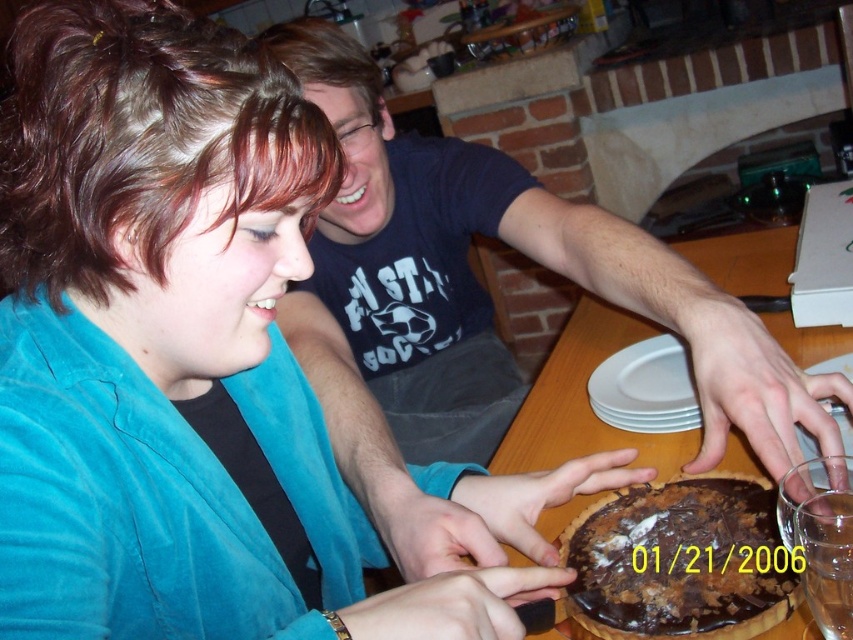
Is dark blue t-shirt at center positioned at the back of white matte plate at center?

No.

Is point (495, 216) positioned behind point (625, 346)?

Yes.

Where is `dark blue t-shirt at center`? Image resolution: width=853 pixels, height=640 pixels. dark blue t-shirt at center is located at coordinates (515, 248).

Can you confirm if dark blue t-shirt at center is positioned above wooden table at center?

Correct, dark blue t-shirt at center is located above wooden table at center.

Which is below, dark blue t-shirt at center or wooden table at center?

wooden table at center

Which is behind, point (448, 280) or point (804, 620)?

Point (448, 280)

Identify the location of dark blue t-shirt at center. (515, 248).

Which is behind, point (518, 436) or point (621, 371)?

The point (621, 371) is behind.

Can you confirm if wooden table at center is positioned below white matte plate at center?

Actually, wooden table at center is above white matte plate at center.

Between point (607, 308) and point (664, 333), which one is positioned behind?

The point (607, 308) is behind.

Locate an element on the screen. wooden table at center is located at coordinates (583, 400).